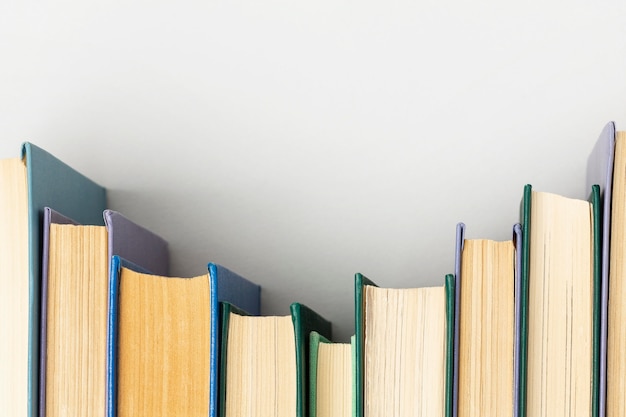
You are a GUI agent. You are given a task and a screenshot of the screen. Output one action in this format:
    pyautogui.click(x=<x>, y=<y>)
    Task: Click on the blue books
    The width and height of the screenshot is (626, 417).
    Given the screenshot: What is the action you would take?
    pyautogui.click(x=44, y=170), pyautogui.click(x=600, y=165), pyautogui.click(x=483, y=273), pyautogui.click(x=156, y=307), pyautogui.click(x=93, y=306)